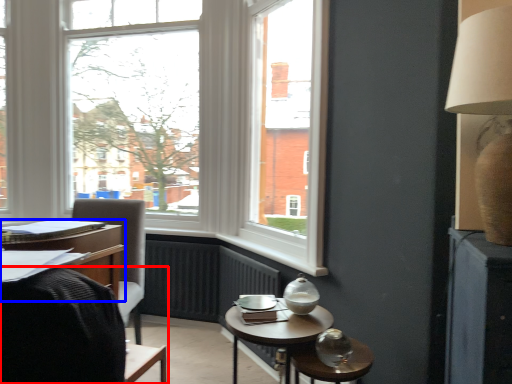
Question: Among these objects, which one is nearest to the camera, chair (highlighted by a red box) or desk (highlighted by a blue box)?

Choices:
 (A) chair
 (B) desk

Answer: (B)